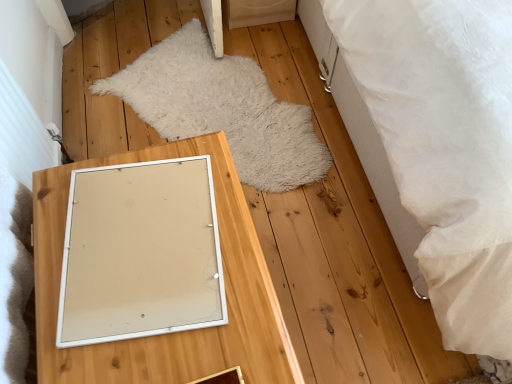
This screenshot has width=512, height=384. Identify the location of wooden mirror at center. (168, 335).

In order to face white matte picture frame at center, should I rotate leftwards or rightwards?

To face it directly, rotate left by 14.967 degrees.

Where is `white textured bed at right`? white textured bed at right is located at coordinates (439, 146).

Which is more to the left, white textured bed at right or wooden mirror at center?

Positioned to the left is wooden mirror at center.

Is the depth of white textured bed at right greater than that of wooden mirror at center?

No, white textured bed at right is closer to the viewer.

Is white textured bed at right looking in the opposite direction of wooden mirror at center?

No, white textured bed at right's orientation is not away from wooden mirror at center.

Considering the positions of objects white fluffy rug at center and wooden mirror at center in the image provided, who is in front, white fluffy rug at center or wooden mirror at center?

wooden mirror at center is closer to the camera.

Is point (239, 177) farther from camera compared to point (54, 203)?

Yes, point (239, 177) is behind point (54, 203).

Between white fluffy rug at center and wooden mirror at center, which one has less height?

Standing shorter between the two is white fluffy rug at center.

Which of these two, white textured bed at right or white fluffy rug at center, stands taller?

Standing taller between the two is white textured bed at right.

From the picture: Considering the sizes of objects white textured bed at right and white fluffy rug at center in the image provided, who is smaller, white textured bed at right or white fluffy rug at center?

white fluffy rug at center.

Considering the points (398, 201) and (228, 133), which point is in front, point (398, 201) or point (228, 133)?

Point (398, 201)

From the picture: Is white textured bed at right oriented away from white fluffy rug at center?

No.

Based on the photo, what's the angular difference between wooden mirror at center and white fluffy rug at center's facing directions?

They differ by 1.22 degrees in their facing directions.

Considering their positions, is wooden mirror at center located in front of or behind white fluffy rug at center?

wooden mirror at center is in front of white fluffy rug at center.

From a real-world perspective, is wooden mirror at center positioned above or below white fluffy rug at center?

In terms of real-world spatial position, wooden mirror at center is above white fluffy rug at center.

Image resolution: width=512 pixels, height=384 pixels. What are the coordinates of `furniture that appears in front of the white fluffy rug at center` in the screenshot? It's located at point(168,335).

Is white fluffy rug at center facing towards white matte picture frame at center?

No, white fluffy rug at center does not turn towards white matte picture frame at center.

Is white fluffy rug at center taller than white matte picture frame at center?

Correct, white fluffy rug at center is much taller as white matte picture frame at center.

Between white fluffy rug at center and white matte picture frame at center, which one has smaller width?

white matte picture frame at center is thinner.

From a real-world perspective, between white fluffy rug at center and white matte picture frame at center, who is vertically lower?

In real-world perspective, white fluffy rug at center is lower.

Between white fluffy rug at center and white textured bed at right, which one has smaller width?

white fluffy rug at center.

Is white textured bed at right located within white fluffy rug at center?

Actually, white textured bed at right is outside white fluffy rug at center.

Can you confirm if white fluffy rug at center is positioned to the right of white textured bed at right?

No.

Which is more to the right, white textured bed at right or white matte picture frame at center?

white textured bed at right.

You are a GUI agent. You are given a task and a screenshot of the screen. Output one action in this format:
    pyautogui.click(x=<x>, y=<y>)
    Task: Click on the picture frame above the white textured bed at right (from a real-world perspective)
    Image resolution: width=512 pixels, height=384 pixels.
    Given the screenshot: What is the action you would take?
    pyautogui.click(x=141, y=252)

How much distance is there between white textured bed at right and white matte picture frame at center?

white textured bed at right is 24.21 inches away from white matte picture frame at center.

Is white textured bed at right further to the viewer compared to white matte picture frame at center?

No, white textured bed at right is closer to the camera.

Locate an element on the screen. bed in front of the wooden mirror at center is located at coordinates (439, 146).

This screenshot has height=384, width=512. Identify the location of blanket behind the wooden mirror at center. (222, 109).

In the scene shown: Looking at the image, which one is located further to wooden mirror at center, white matte picture frame at center or white textured bed at right?

Based on the image, white textured bed at right appears to be further to wooden mirror at center.

Considering their positions, is wooden mirror at center positioned further to white matte picture frame at center than white fluffy rug at center?

white fluffy rug at center lies further to white matte picture frame at center than the other object.

Looking at the image, which one is located closer to wooden mirror at center, white fluffy rug at center or white textured bed at right?

Among the two, white textured bed at right is located nearer to wooden mirror at center.

Considering their positions, is white textured bed at right positioned further to white fluffy rug at center than white matte picture frame at center?

Among the two, white matte picture frame at center is located further to white fluffy rug at center.

Which object lies further to the anchor point white matte picture frame at center, white fluffy rug at center or wooden mirror at center?

The object further to white matte picture frame at center is white fluffy rug at center.

When comparing their distances from white textured bed at right, does wooden mirror at center or white fluffy rug at center seem closer?

Based on the image, wooden mirror at center appears to be nearer to white textured bed at right.

Based on their spatial positions, is white matte picture frame at center or wooden mirror at center further from white textured bed at right?

white matte picture frame at center is positioned further to the anchor white textured bed at right.

Considering their positions, is wooden mirror at center positioned closer to white fluffy rug at center than white textured bed at right?

white textured bed at right lies closer to white fluffy rug at center than the other object.

I want to click on furniture located between white textured bed at right and white fluffy rug at center in the depth direction, so click(x=168, y=335).

I want to click on picture frame between wooden mirror at center and white fluffy rug at center in the front-back direction, so click(141, 252).

This screenshot has width=512, height=384. Find the location of `picture frame located between white textured bed at right and white fluffy rug at center in the depth direction`. picture frame located between white textured bed at right and white fluffy rug at center in the depth direction is located at coordinates (141, 252).

The image size is (512, 384). What are the coordinates of `furniture located between white matte picture frame at center and white textured bed at right in the left-right direction` in the screenshot? It's located at (168, 335).